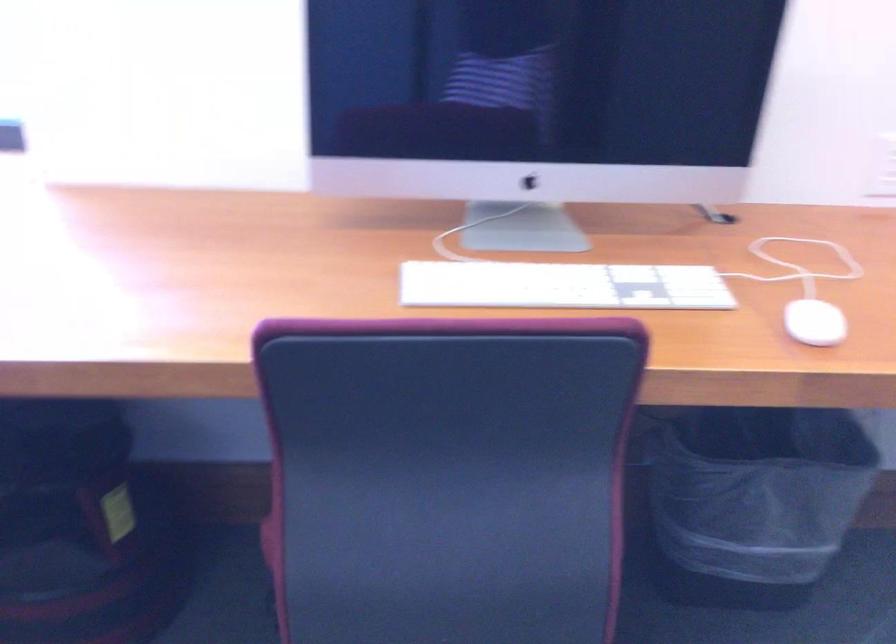
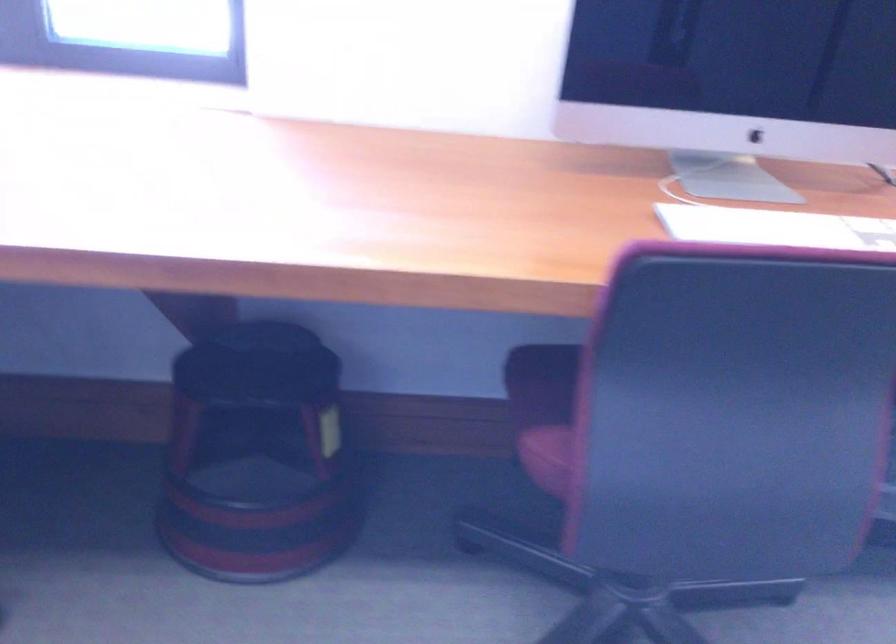
Question: The images are taken continuously from a first-person perspective. In which direction are you moving?

Choices:
 (A) Left
 (B) Right
 (C) Forward
 (D) Backward

Answer: (A)